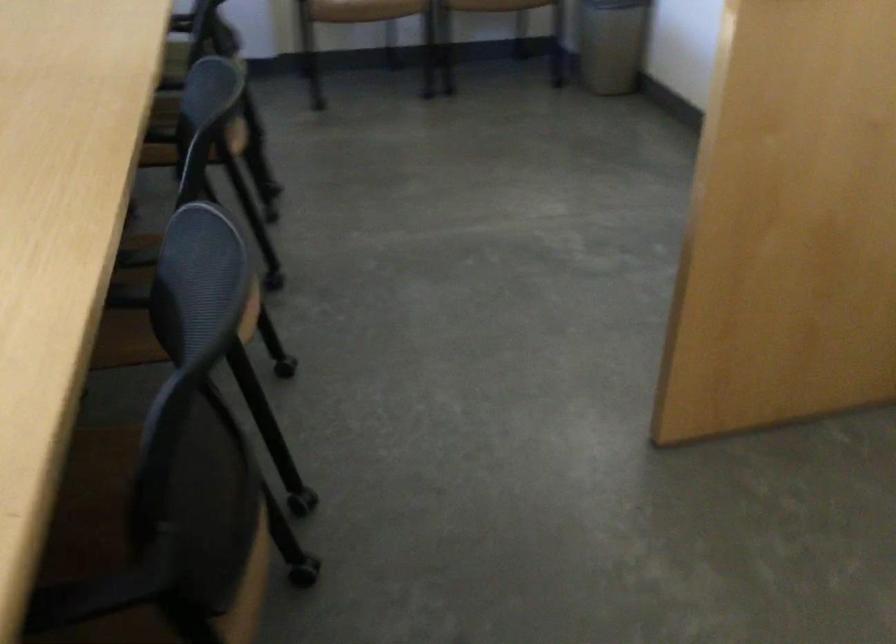
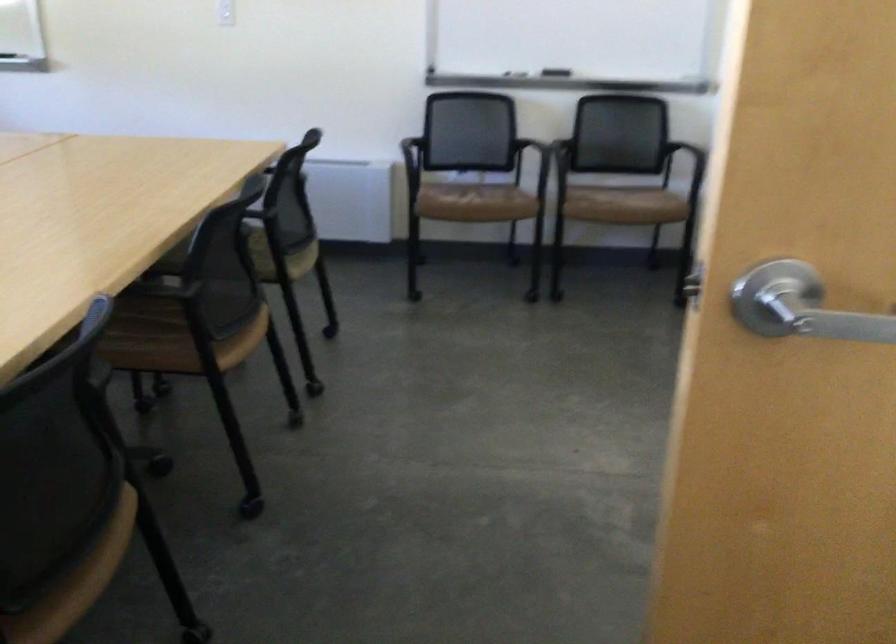
First-person continuous shooting, in which direction is the camera rotating?

The rotation direction of the camera is right-down.